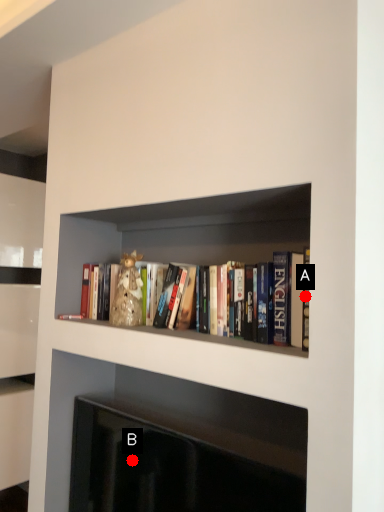
Question: Two points are circled on the image, labeled by A and B beside each circle. Which point is farther to the camera?

Choices:
 (A) A is further
 (B) B is further

Answer: (B)